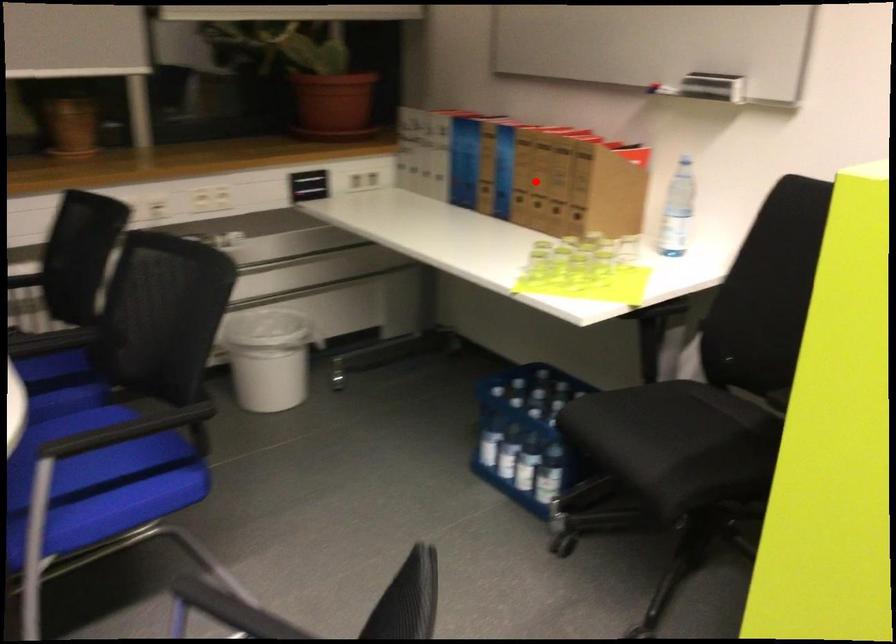
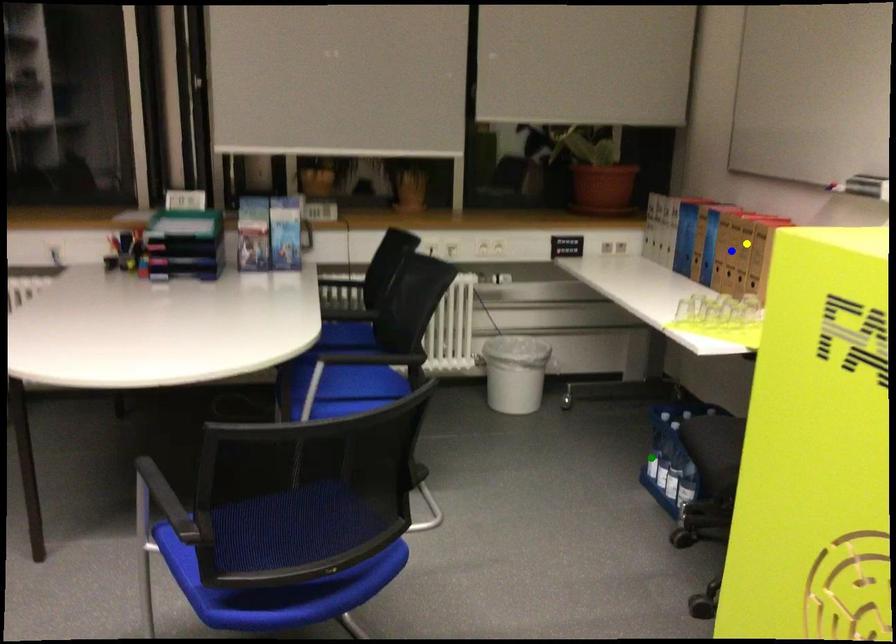
Question: I am providing you with two images of the same scene from different viewpoints. A red point is marked on the first image. You are given multiple points on the second image. In image 2, which mark is for the same physical point as the one in image 1?

Choices:
 (A) blue point
 (B) yellow point
 (C) green point

Answer: (A)